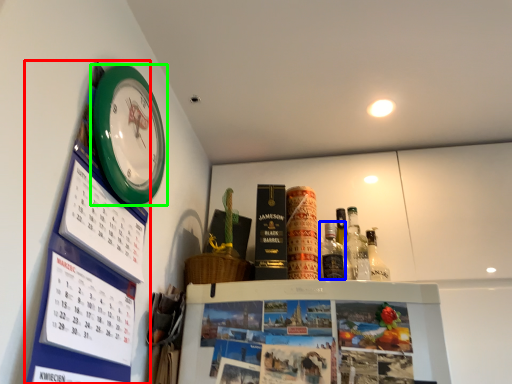
Question: Which object is the farthest from bulletin board (highlighted by a red box)? Choose among these: bottle (highlighted by a blue box) or wall clock (highlighted by a green box).

Choices:
 (A) bottle
 (B) wall clock

Answer: (A)